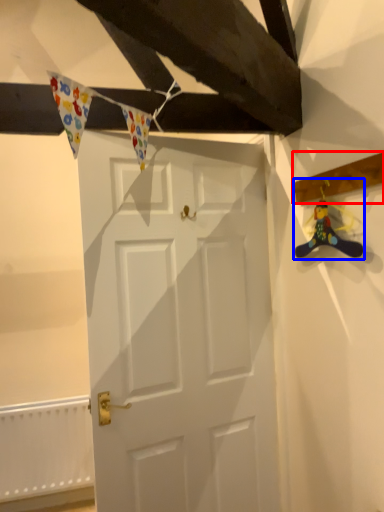
Question: Among these objects, which one is farthest to the camera, plank (highlighted by a red box) or miniature (highlighted by a blue box)?

Choices:
 (A) plank
 (B) miniature

Answer: (B)